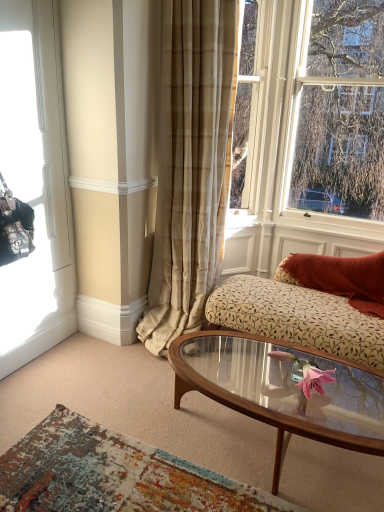
Question: Is wooden glass coffee table at center wider or thinner than distressed rug at lower left?

Choices:
 (A) wide
 (B) thin

Answer: (B)

Question: From a real-world perspective, is wooden glass coffee table at center positioned above or below distressed rug at lower left?

Choices:
 (A) above
 (B) below

Answer: (A)

Question: Estimate the real-world distances between objects in this image. Which object is farther from the distressed rug at lower left?

Choices:
 (A) beige plaid curtain at center
 (B) clear glass window at upper right, the first window in the right-to-left sequence
 (C) wooden glass coffee table at center
 (D) floral-patterned fabric couch at right
 (E) black leather handbag at left, the second window when ordered from right to left

Answer: (B)

Question: Which of these objects is positioned farthest from the floral-patterned fabric couch at right?

Choices:
 (A) wooden glass coffee table at center
 (B) clear glass window at upper right, the first window in the right-to-left sequence
 (C) beige plaid curtain at center
 (D) black leather handbag at left, the second window when ordered from right to left
 (E) pink glass flower at center

Answer: (D)